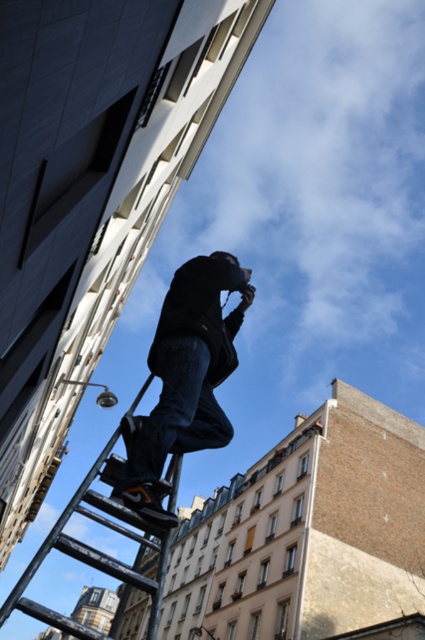
You are a delivery person carrying a box that is 2 meters wide. You need to walk through the space between the denim jeans at center and the metallic black ladder at lower center. Is there enough space for you to pass through?

The denim jeans at center and metallic black ladder at lower center are 26.40 meters apart from each other. Since the distance between them is much larger than the 2 meters width of your box, you can easily pass through the space between them.

You are a photographer trying to decide whether to place a small tripod between the denim jeans at center and the metallic black ladder at lower center. Given their sizes, can the tripod fit between them?

The denim jeans at center is smaller than the metallic black ladder at lower center, so there might be enough space between them to fit the tripod, but the exact distance isn generated in the description.